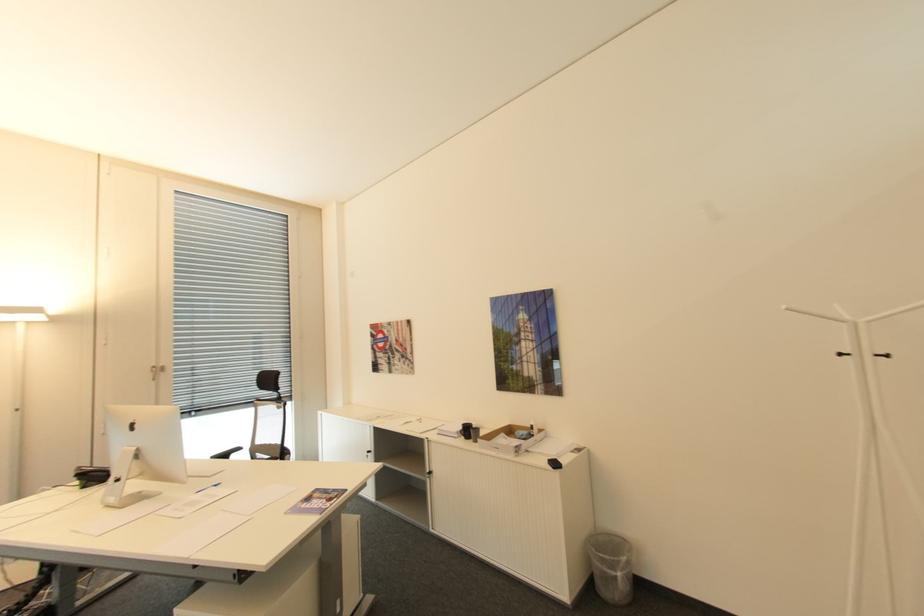
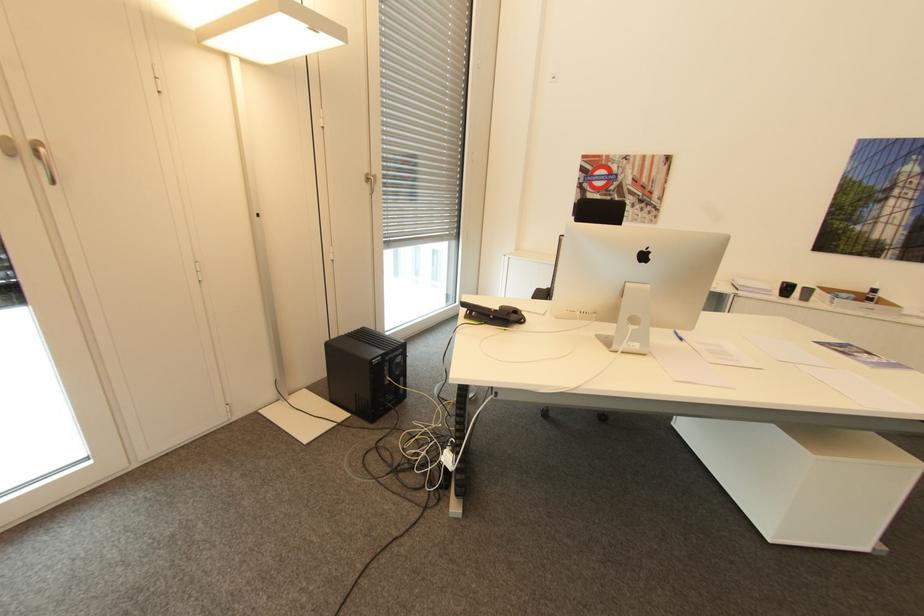
Question: Which direction would the cameraman need to move to produce the second image? Reply with the corresponding letter.

Choices:
 (A) Left
 (B) Right
 (C) Forward
 (D) Backward

Answer: (A)